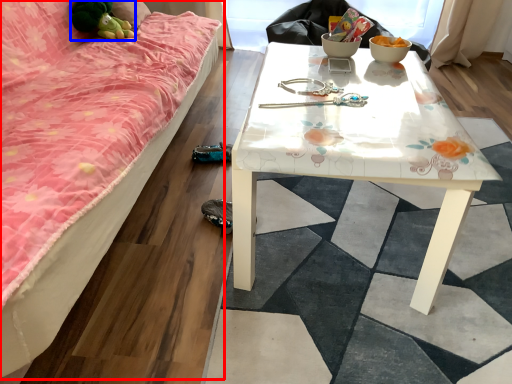
Question: Which object is closer to the camera taking this photo, studio couch (highlighted by a red box) or toy (highlighted by a blue box)?

Choices:
 (A) studio couch
 (B) toy

Answer: (A)